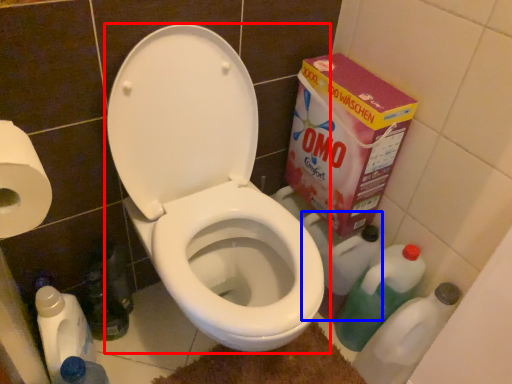
Question: Among these objects, which one is nearest to the camera, toilet (highlighted by a red box) or cleaning product (highlighted by a blue box)?

Choices:
 (A) toilet
 (B) cleaning product

Answer: (A)